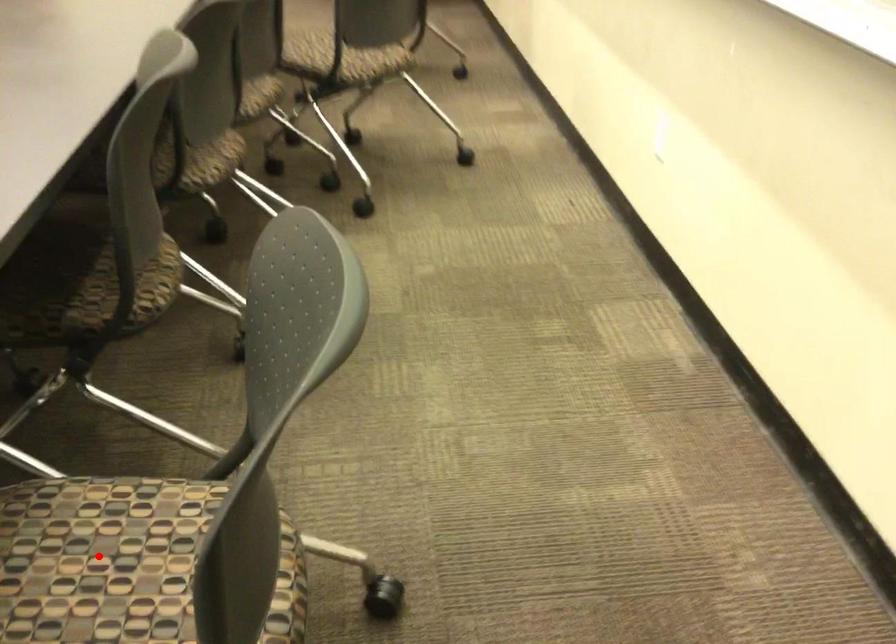
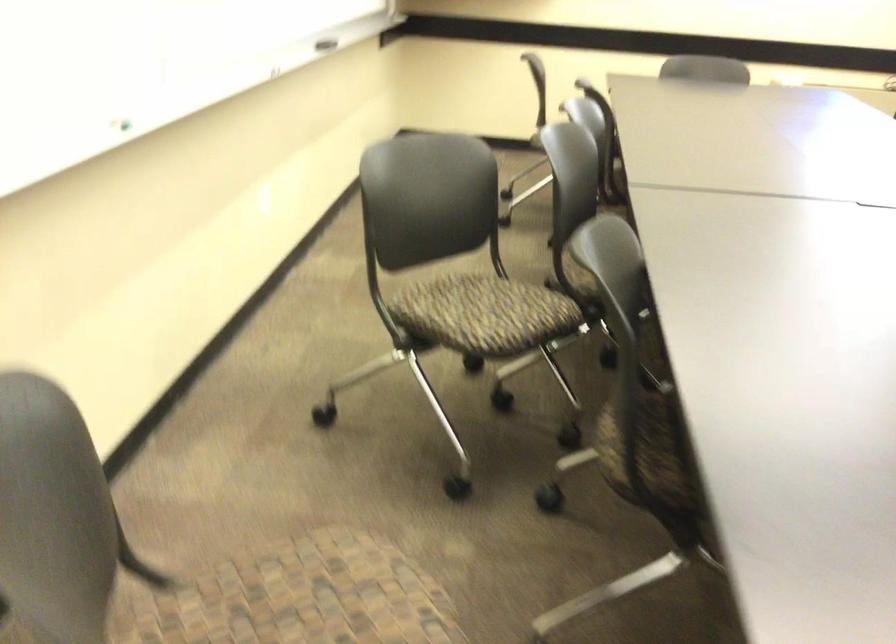
Question: I am providing you with two images of the same scene from different viewpoints. A red point is marked on the first image. Is the red point's position out of view in image 2?

Choices:
 (A) Yes
 (B) No

Answer: (A)